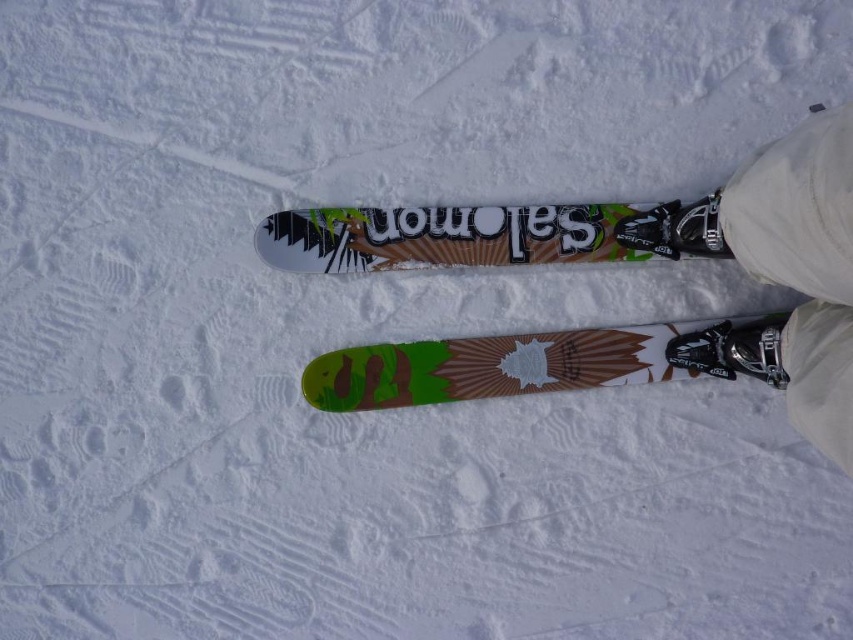
Image resolution: width=853 pixels, height=640 pixels. What are the coordinates of `white fabric pants at lower right` in the screenshot? It's located at (778, 273).

Is white fabric pants at lower right thinner than multicolored glossy snowboard at center?

Indeed, white fabric pants at lower right has a lesser width compared to multicolored glossy snowboard at center.

Between point (769, 280) and point (637, 212), which one is positioned behind?

Point (637, 212)

Locate an element on the screen. white fabric pants at lower right is located at coordinates (778, 273).

Can you confirm if white fabric pants at lower right is smaller than green matte snowboard at center?

No, white fabric pants at lower right is not smaller than green matte snowboard at center.

Which is behind, point (773, 179) or point (595, 340)?

The point (595, 340) is more distant.

Identify the location of white fabric pants at lower right. The image size is (853, 640). (778, 273).

Does green matte snowboard at center have a larger size compared to metallic silver ski boot at lower right?

Yes.

Does green matte snowboard at center come behind metallic silver ski boot at lower right?

Yes, it is behind metallic silver ski boot at lower right.

Which is behind, point (538, 349) or point (747, 353)?

The point (538, 349) is more distant.

Locate an element on the screen. This screenshot has height=640, width=853. green matte snowboard at center is located at coordinates (500, 364).